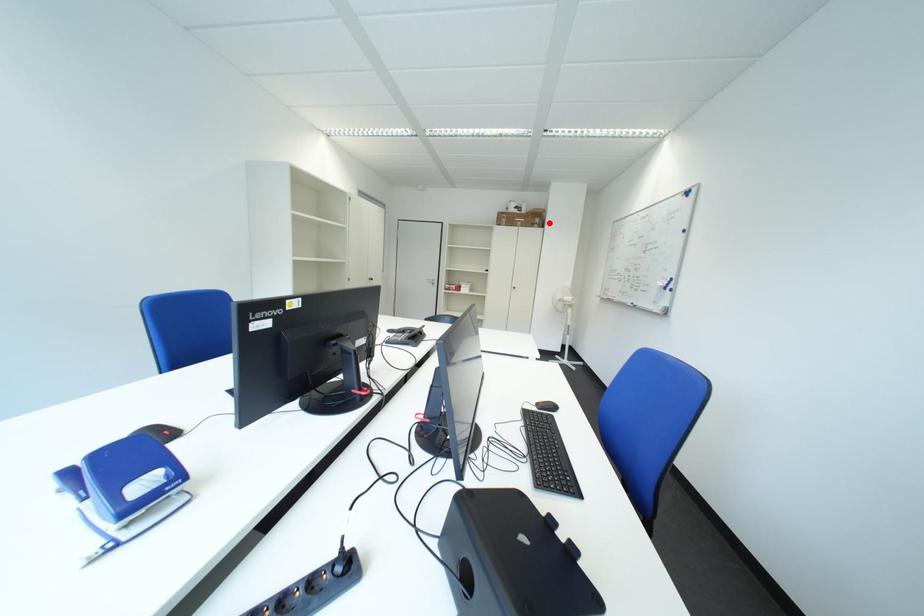
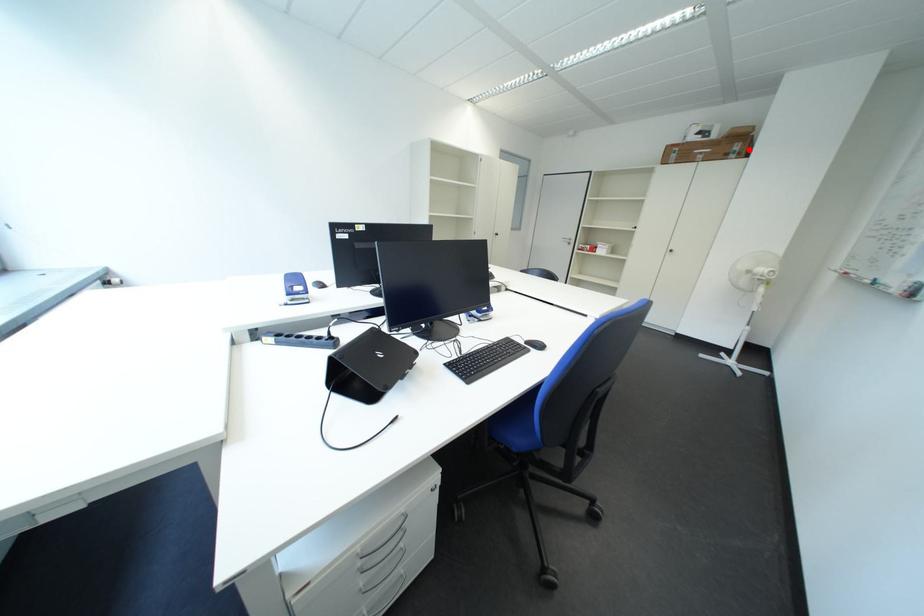
I am providing you with two images of the same scene from different viewpoints. A red point is marked on the first image and another point is marked on the second image. Do the highlighted points in image1 and image2 indicate the same real-world spot?

Yes